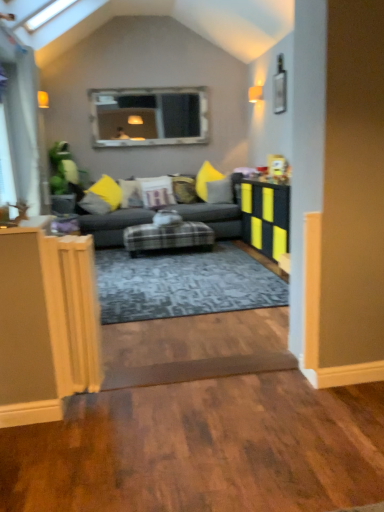
What is the approximate width of plush gray couch at center?

The width of plush gray couch at center is 1.22 meters.

The image size is (384, 512). Find the location of `transparent glass door at left`. transparent glass door at left is located at coordinates (19, 126).

Looking at this image, from the image's perspective, would you say transparent glass door at left is positioned over velvet yellow pillow at center, the 5th pillow when ordered from left to right?

Yes, from the image's perspective, transparent glass door at left is on top of velvet yellow pillow at center, the 5th pillow when ordered from left to right.

Is transparent glass door at left far from velvet yellow pillow at center, the 5th pillow when ordered from left to right?

transparent glass door at left is far away from velvet yellow pillow at center, the 5th pillow when ordered from left to right.

Considering the positions of objects transparent glass door at left and velvet yellow pillow at center, the 5th pillow when ordered from left to right, in the image provided, who is in front, transparent glass door at left or velvet yellow pillow at center, the 5th pillow when ordered from left to right,?

Positioned in front is transparent glass door at left.

Considering the positions of point (14, 62) and point (218, 196), is point (14, 62) closer or farther from the camera than point (218, 196)?

Point (14, 62) is positioned closer to the camera compared to point (218, 196).

Is clear glass window at upper center spatially inside brown wood plank at lower center, or outside of it?

clear glass window at upper center is outside brown wood plank at lower center.

From their relative heights in the image, would you say clear glass window at upper center is taller or shorter than brown wood plank at lower center?

In the image, clear glass window at upper center appears to be taller than brown wood plank at lower center.

Is clear glass window at upper center aimed at brown wood plank at lower center?

No, clear glass window at upper center is not aimed at brown wood plank at lower center.

What's the angular difference between clear glass window at upper center and brown wood plank at lower center's facing directions?

The angular difference between clear glass window at upper center and brown wood plank at lower center is 0.236 degrees.

Does yellow fabric pillow at left, marked as the 1th pillow in a left-to-right arrangement, turn towards white fabric pillow at center, the third pillow when ordered from left to right?

Yes, yellow fabric pillow at left, marked as the 1th pillow in a left-to-right arrangement, is facing white fabric pillow at center, the third pillow when ordered from left to right.

Based on their sizes in the image, would you say yellow fabric pillow at left, which is the 5th pillow in right-to-left order, is bigger or smaller than white fabric pillow at center, the third pillow when ordered from left to right?

Clearly, yellow fabric pillow at left, which is the 5th pillow in right-to-left order, is larger in size than white fabric pillow at center, the third pillow when ordered from left to right.

Can you see yellow fabric pillow at left, marked as the 1th pillow in a left-to-right arrangement, touching white fabric pillow at center, the third pillow when ordered from left to right?

No, yellow fabric pillow at left, marked as the 1th pillow in a left-to-right arrangement, is not beside white fabric pillow at center, the third pillow when ordered from left to right.

Is velvet yellow pillow at center, arranged as the second pillow when viewed from the left, beside plush gray couch at center?

velvet yellow pillow at center, arranged as the second pillow when viewed from the left, and plush gray couch at center are clearly separated.

Is plush gray couch at center at the back of velvet yellow pillow at center, arranged as the second pillow when viewed from the left?

Yes, plush gray couch at center is at the back of velvet yellow pillow at center, arranged as the second pillow when viewed from the left.

Is point (121, 188) positioned in front of point (215, 221)?

No, it is not.

From the plush gray couch at center, count 3rd pillows backward and point to it. Please provide its 2D coordinates.

[(130, 194)]

Is point (179, 192) closer to viewer compared to point (99, 195)?

That is False.

Which of these two, velvet yellow pillow at center, the 4th pillow viewed from the left, or yellow fabric pillow at left, marked as the 1th pillow in a left-to-right arrangement, is bigger?

yellow fabric pillow at left, marked as the 1th pillow in a left-to-right arrangement, is bigger.

Can you confirm if velvet yellow pillow at center, positioned as the second pillow in right-to-left order, is thinner than yellow fabric pillow at left, marked as the 1th pillow in a left-to-right arrangement?

Yes.

How distant is matte black table at right from plaid fabric ottoman at center?

matte black table at right and plaid fabric ottoman at center are 34.18 inches apart.

From the image's perspective, which one is positioned higher, matte black table at right or plaid fabric ottoman at center?

matte black table at right, from the image's perspective.

Is there a large distance between matte black table at right and plaid fabric ottoman at center?

matte black table at right is near plaid fabric ottoman at center, not far away.

From a real-world perspective, is matte black table at right on plaid fabric ottoman at center?

Yes, from a real-world perspective, matte black table at right is over plaid fabric ottoman at center

From a real-world perspective, who is located higher, transparent glass door at left or matte black table at right?

transparent glass door at left.

Looking at this image, would you say matte black table at right is part of transparent glass door at left's contents?

No, matte black table at right is not inside transparent glass door at left.

From their relative heights in the image, would you say transparent glass door at left is taller or shorter than matte black table at right?

transparent glass door at left is taller than matte black table at right.

Where is `table in front of the transparent glass door at left`? This screenshot has width=384, height=512. table in front of the transparent glass door at left is located at coordinates tap(265, 216).

Locate an element on the screen. The height and width of the screenshot is (512, 384). the 4th pillow below the transparent glass door at left (from a real-world perspective) is located at coordinates (220, 191).

Image resolution: width=384 pixels, height=512 pixels. In order to click on window above the brown wood plank at lower center (from a real-world perspective) in this screenshot , I will do `click(150, 116)`.

Estimate the real-world distances between objects in this image. Which object is further from velvet yellow pillow at center, arranged as the second pillow when viewed from the left, transparent glass door at left or matte black table at right?

matte black table at right lies further to velvet yellow pillow at center, arranged as the second pillow when viewed from the left, than the other object.

Looking at the image, which one is located further to clear glass window at upper center, velvet yellow pillow at center, the 4th pillow viewed from the left, or plush gray couch at center?

Among the two, plush gray couch at center is located further to clear glass window at upper center.

Considering their positions, is velvet yellow pillow at center, arranged as the first pillow when viewed from the right, positioned further to velvet yellow pillow at center, the 4th pillow viewed from the left, than plush gray couch at center?

plush gray couch at center is positioned further to the anchor velvet yellow pillow at center, the 4th pillow viewed from the left.

Based on their spatial positions, is plush gray couch at center or yellow fabric pillow at left, marked as the 1th pillow in a left-to-right arrangement, further from velvet yellow pillow at center, the 4th pillow viewed from the left?

Among the two, yellow fabric pillow at left, marked as the 1th pillow in a left-to-right arrangement, is located further to velvet yellow pillow at center, the 4th pillow viewed from the left.

Estimate the real-world distances between objects in this image. Which object is further from velvet yellow pillow at center, positioned as the second pillow in right-to-left order, matte black table at right or plush gray couch at center?

matte black table at right.

Estimate the real-world distances between objects in this image. Which object is further from velvet yellow pillow at center, arranged as the second pillow when viewed from the left, velvet yellow pillow at center, positioned as the second pillow in right-to-left order, or plaid fabric ottoman at center?

Based on the image, plaid fabric ottoman at center appears to be further to velvet yellow pillow at center, arranged as the second pillow when viewed from the left.

Which object lies nearer to the anchor point transparent glass door at left, clear glass window at upper center or yellow fabric pillow at left, which is the 5th pillow in right-to-left order?

yellow fabric pillow at left, which is the 5th pillow in right-to-left order.

Which object lies nearer to the anchor point velvet yellow pillow at center, the 4th pillow viewed from the left, brown wood plank at lower center or velvet yellow pillow at center, arranged as the first pillow when viewed from the right?

velvet yellow pillow at center, arranged as the first pillow when viewed from the right, is closer to velvet yellow pillow at center, the 4th pillow viewed from the left.

Find the location of `studio couch located between white fabric pillow at center, which is the 3th pillow in right-to-left order, and velvet yellow pillow at center, the 5th pillow when ordered from left to right, in the left-right direction`. studio couch located between white fabric pillow at center, which is the 3th pillow in right-to-left order, and velvet yellow pillow at center, the 5th pillow when ordered from left to right, in the left-right direction is located at coordinates (113, 224).

Find the location of a particular element. The image size is (384, 512). studio couch between yellow fabric pillow at left, marked as the 1th pillow in a left-to-right arrangement, and plaid fabric ottoman at center is located at coordinates [x=113, y=224].

Identify the location of furniture between transparent glass door at left and velvet yellow pillow at center, the 4th pillow viewed from the left, from left to right. coord(168,237).

Locate an element on the screen. This screenshot has height=512, width=384. plank between transparent glass door at left and matte black table at right in the horizontal direction is located at coordinates (198, 370).